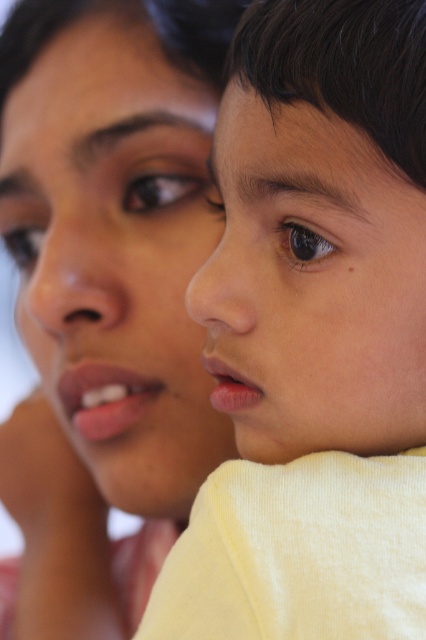
Based on the scene description, can you determine the spatial relationship between the smooth cream sweater at right and the smooth skin face at center?

The smooth cream sweater at right is located below the smooth skin face at center.

Based on the scene description, which object occupies more space in the image between the smooth cream sweater at right and the smooth skin face at center?

The smooth cream sweater at right has a larger size compared to the smooth skin face at center, so it occupies more space in the image.

Based on the photo, based on the scene description, which face is more likely to be in focus? The smooth skin face at upper left or the smooth skin face at center?

The smooth skin face at center is in focus because the scene mentions that the child is in sharp detail, while the adult is slightly blurred in the background.